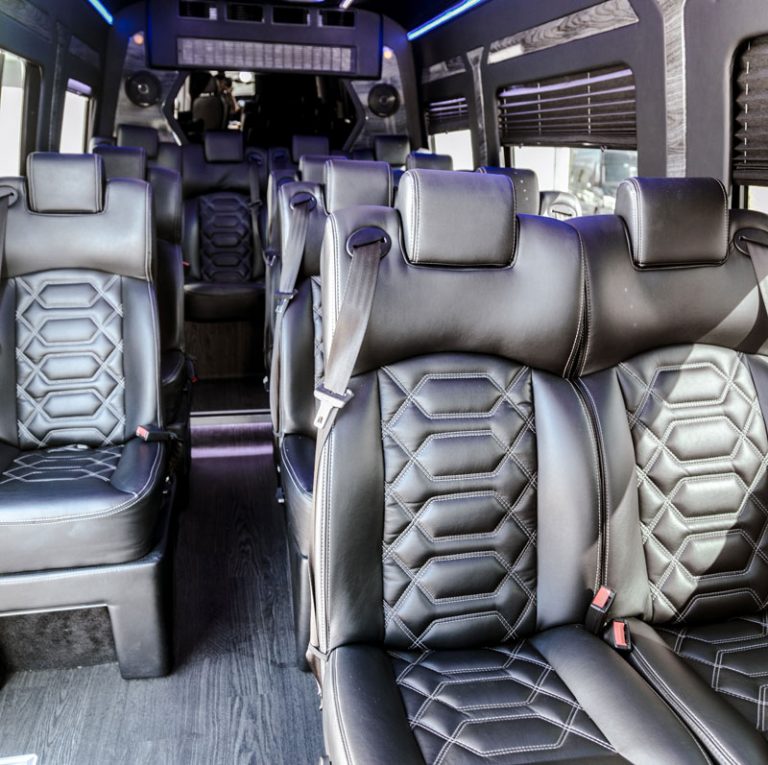
Where is `blinds`? blinds is located at coordinates (584, 108), (432, 121), (750, 148).